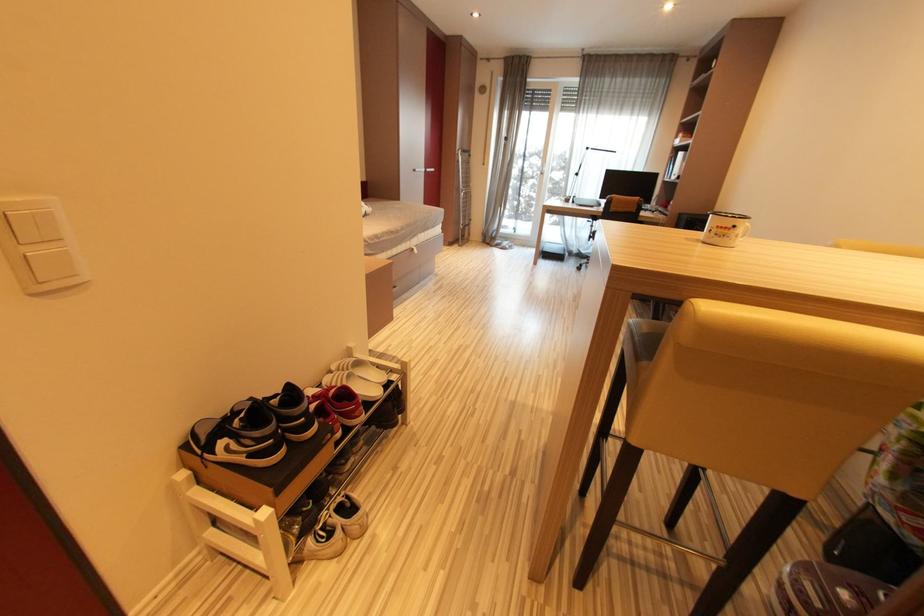
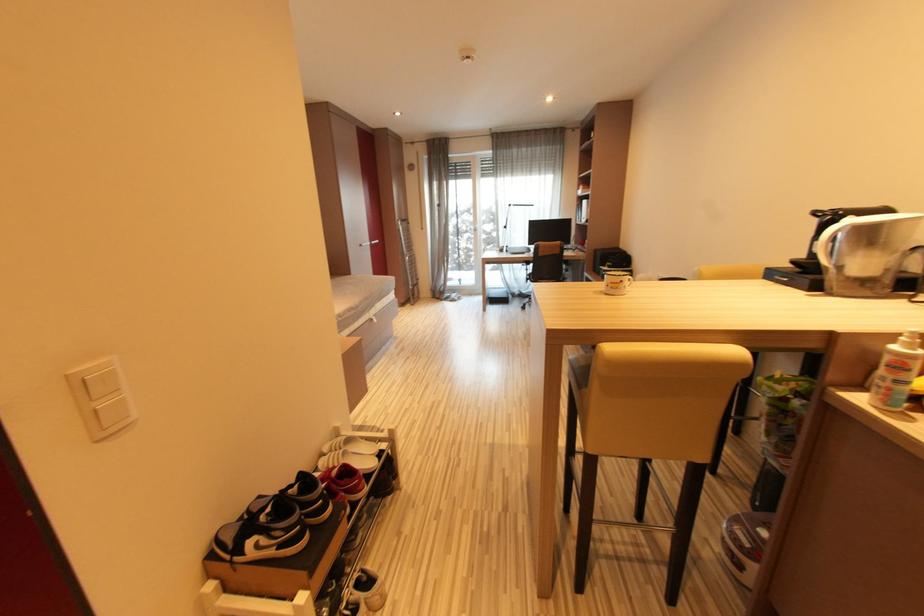
Question: Which direction would the cameraman need to move to produce the second image? Reply with the corresponding letter.

Choices:
 (A) Left
 (B) Right
 (C) Forward
 (D) Backward

Answer: (D)